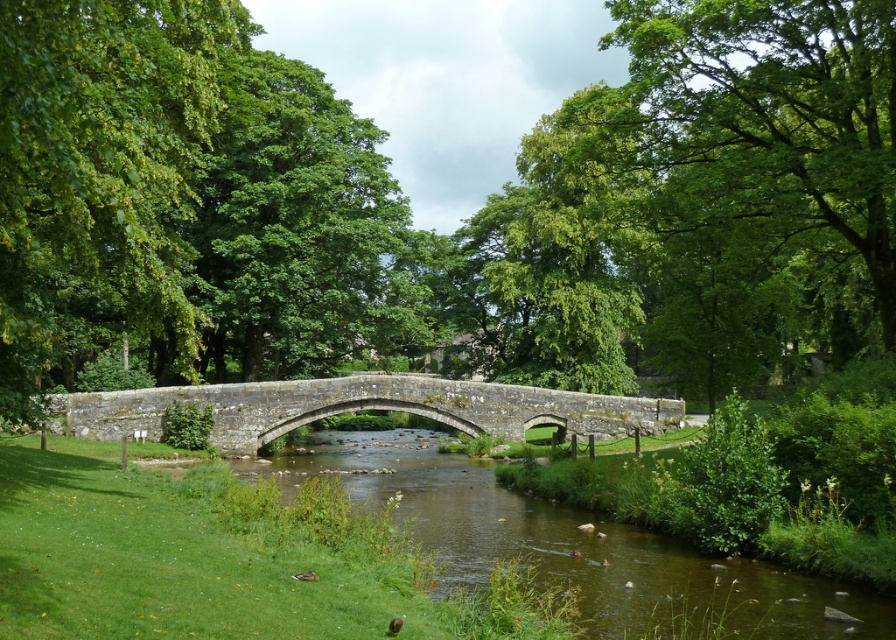
Does green leafy tree at center appear over stone bridge at center?

Yes, green leafy tree at center is above stone bridge at center.

This screenshot has width=896, height=640. What do you see at coordinates (431, 230) in the screenshot? I see `green leafy tree at center` at bounding box center [431, 230].

Who is more distant from viewer, (179, 54) or (279, 401)?

The point (279, 401) is more distant.

Identify the location of green leafy tree at center. Image resolution: width=896 pixels, height=640 pixels. (431, 230).

Is green leafy tree at center positioned at the back of green leafy tree at left?

Yes, green leafy tree at center is further from the viewer.

Does green leafy tree at center appear on the left side of green leafy tree at left?

In fact, green leafy tree at center is to the right of green leafy tree at left.

Is point (858, 90) positioned behind point (113, 195)?

Yes, it is behind point (113, 195).

You are a GUI agent. You are given a task and a screenshot of the screen. Output one action in this format:
    pyautogui.click(x=<x>, y=<y>)
    Task: Click on the green leafy tree at center
    
    Given the screenshot: What is the action you would take?
    pyautogui.click(x=431, y=230)

Based on the photo, does green leafy tree at left have a greater height compared to stone bridge at center?

Yes.

Consider the image. Is green leafy tree at left bigger than stone bridge at center?

Correct, green leafy tree at left is larger in size than stone bridge at center.

Who is more distant from viewer, (119, 42) or (114, 406)?

The point (114, 406) is behind.

Identify the location of green leafy tree at left. Image resolution: width=896 pixels, height=640 pixels. (102, 179).